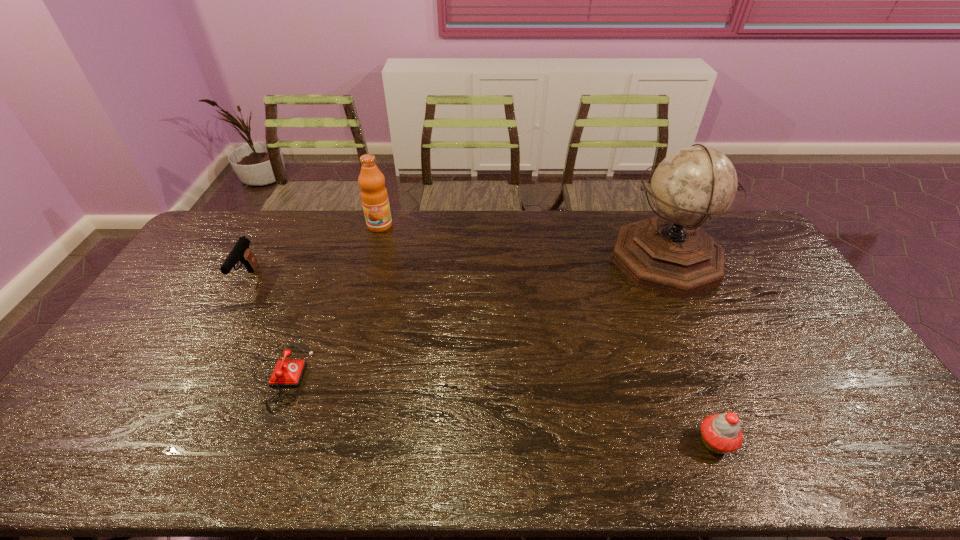
Find the location of `blank space located on the label side of the third object from right to left`. blank space located on the label side of the third object from right to left is located at coordinates (356, 312).

Find the location of `free space located at the barrel of the leftmost object`. free space located at the barrel of the leftmost object is located at coordinates (216, 336).

This screenshot has height=540, width=960. In order to click on vacant space located on the back of the nearest object in this screenshot , I will do `click(662, 314)`.

Where is `vacant point located 0.360m on the dial of the second object from left to right`? The image size is (960, 540). vacant point located 0.360m on the dial of the second object from left to right is located at coordinates (439, 376).

Locate an element on the screen. Image resolution: width=960 pixels, height=540 pixels. globe at the far edge is located at coordinates (670, 254).

Identify the location of fruit juice that is positioned at the far edge. (374, 196).

Image resolution: width=960 pixels, height=540 pixels. Find the location of `object that is at the near edge`. object that is at the near edge is located at coordinates (720, 433).

In the image, there is a desktop. At what (x,y) coordinates should I click in order to perform the action: click on free space at the far edge. Please return your answer as a coordinate pair (x, y). Looking at the image, I should click on (402, 233).

This screenshot has height=540, width=960. I want to click on vacant region at the near edge of the desktop, so click(x=399, y=447).

The height and width of the screenshot is (540, 960). I want to click on vacant space at the left edge, so click(x=209, y=282).